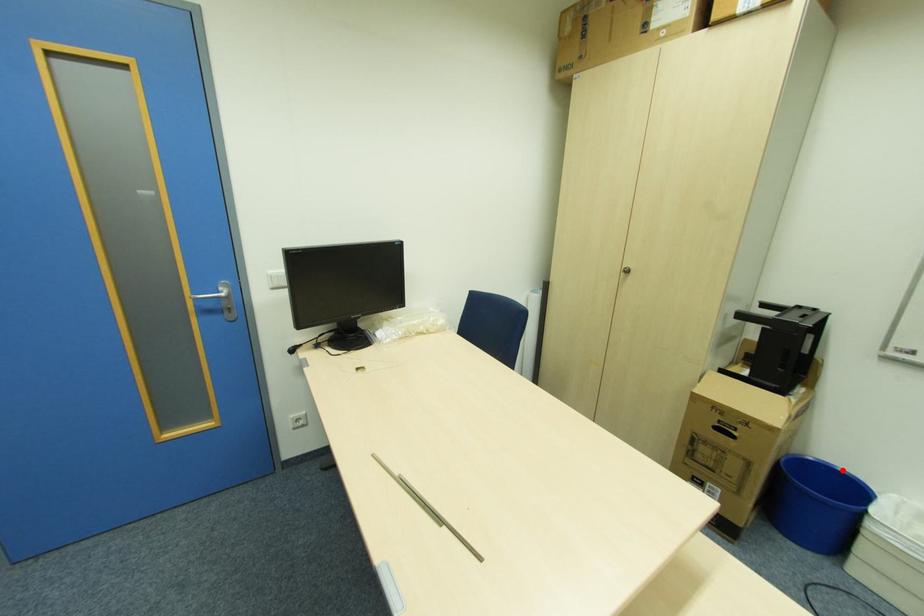
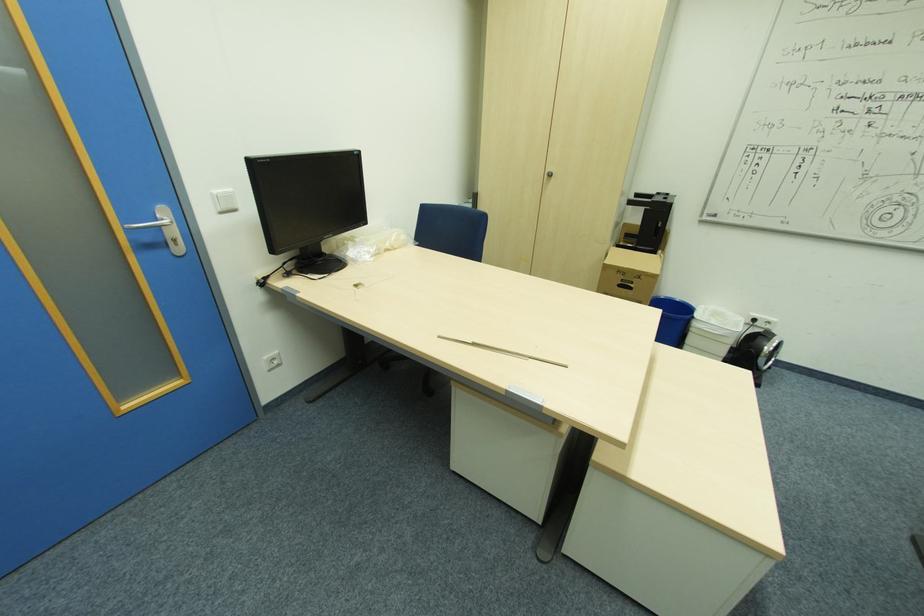
The point at the highlighted location is marked in the first image. Where is the corresponding point in the second image?

(678, 300)